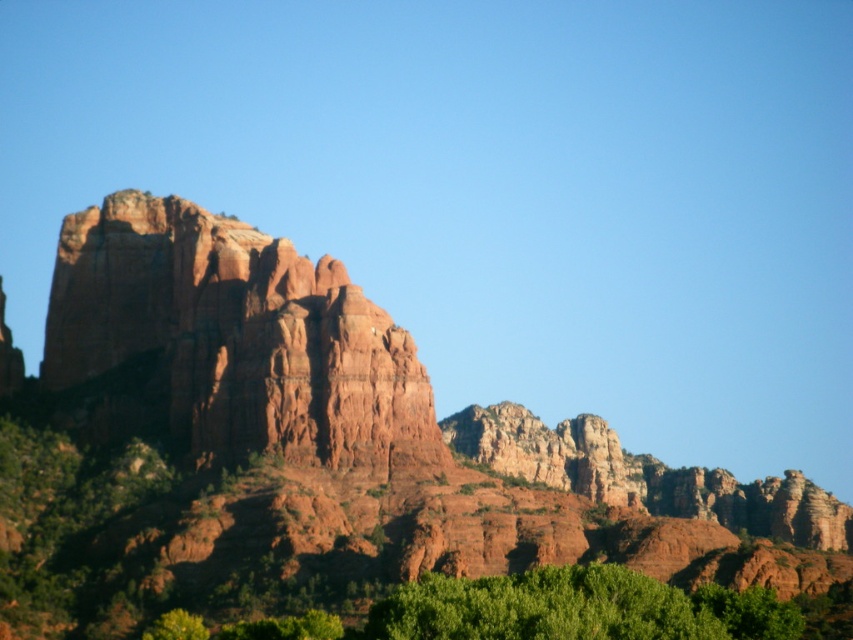
In the scene shown: You are standing at the point marked by coordinates point (316, 449) in the image. Based on the scene description, what prominent natural feature are you directly facing?

The point (316, 449) corresponds to the rustic rock formation at center, so you are directly facing the rustic rock formation at center.

You are standing at the base of the large rock formation and want to take a photo that includes both point (202, 259) and point (148, 280). Based on their positions, which point will appear larger in the photo?

Point (202, 259) will appear larger in the photo because it is closer to the camera than point (148, 280).